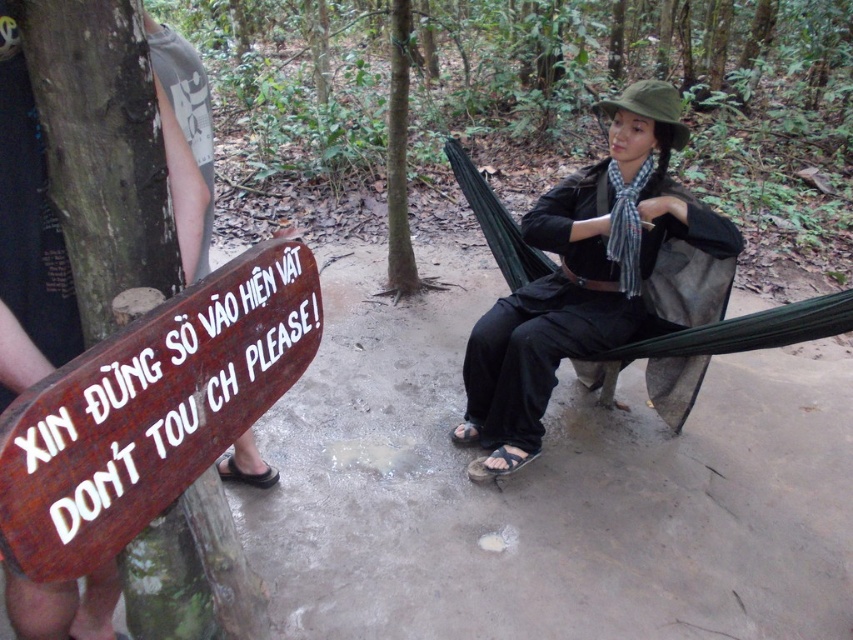
Which is below, matte black outfit at center or brown leather sandal at lower left?

Positioned lower is brown leather sandal at lower left.

I want to click on matte black outfit at center, so click(595, 276).

Is point (674, 106) closer to camera compared to point (222, 472)?

That is True.

At what (x,y) coordinates should I click in order to perform the action: click on matte black outfit at center. Please return your answer as a coordinate pair (x, y). This screenshot has height=640, width=853. Looking at the image, I should click on (595, 276).

Is point (115, 422) behind point (393, 262)?

That is False.

Which is behind, point (242, 397) or point (399, 88)?

Point (399, 88)

Locate an element on the screen. wooden sign at left is located at coordinates (151, 410).

Based on the photo, is matte black outfit at center in front of green rough bark tree at center?

Yes, it is.

Who is taller, matte black outfit at center or green rough bark tree at center?

Result: green rough bark tree at center

What are the coordinates of `matte black outfit at center` in the screenshot? It's located at (595, 276).

Where is `matte black outfit at center`? matte black outfit at center is located at coordinates (595, 276).